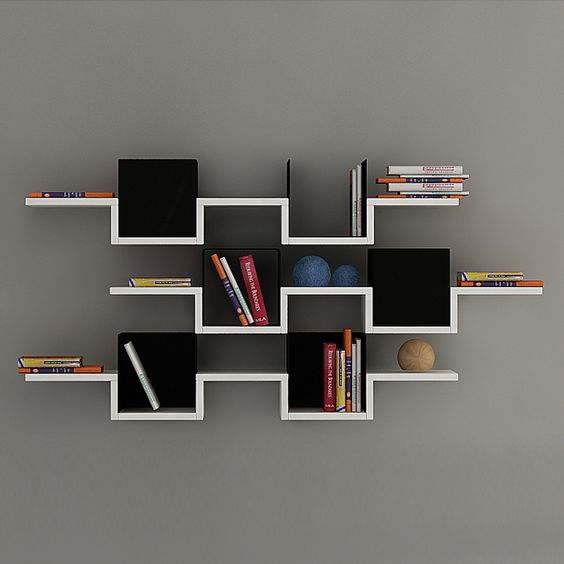
Locate an element on the screen. This screenshot has width=564, height=564. books in middle shelve is located at coordinates (160, 282), (222, 281), (230, 276), (251, 282), (497, 276), (502, 283).